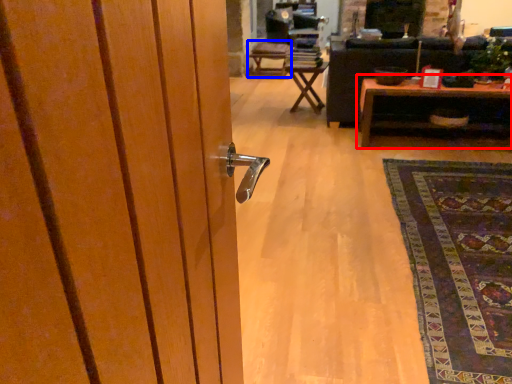
Question: Which point is further to the camera, table (highlighted by a red box) or chair (highlighted by a blue box)?

Choices:
 (A) table
 (B) chair

Answer: (B)